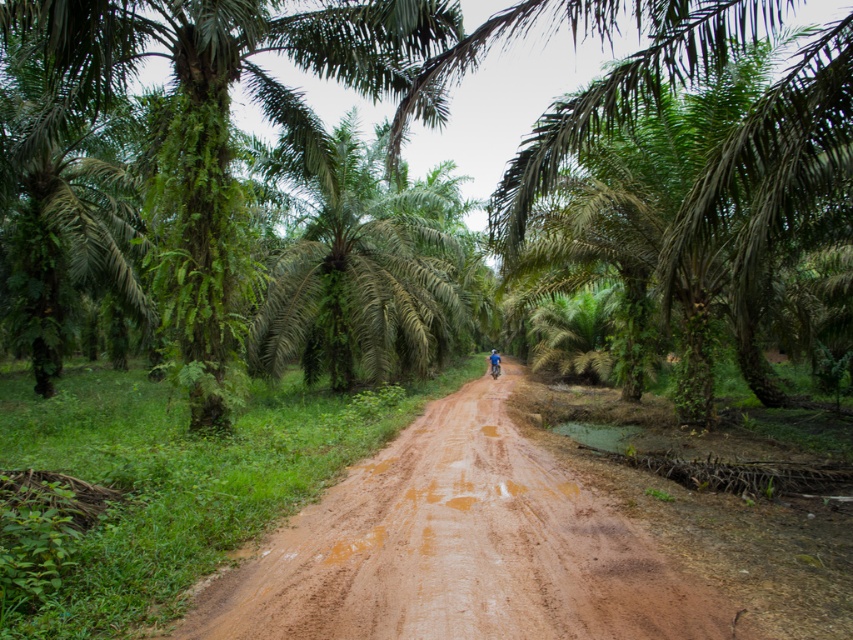
Who is higher up, green leafy palm tree at center or blue fabric helmet at center?

green leafy palm tree at center

Is point (352, 224) farther from camera compared to point (490, 355)?

No, it is in front of (490, 355).

Is point (425, 296) closer to camera compared to point (490, 356)?

Yes, it is in front of point (490, 356).

I want to click on green leafy palm tree at center, so click(x=366, y=269).

Which is above, brown sandy dirt track at center or green leafy palm tree at left?

green leafy palm tree at left

Who is more distant from viewer, (525,492) or (103,26)?

The point (525,492) is more distant.

At what (x,y) coordinates should I click in order to perform the action: click on brown sandy dirt track at center. Please return your answer as a coordinate pair (x, y). The width and height of the screenshot is (853, 640). Looking at the image, I should click on (457, 548).

Can you confirm if green leafy palm tree at left is positioned to the right of blue fabric helmet at center?

Incorrect, green leafy palm tree at left is not on the right side of blue fabric helmet at center.

Does green leafy palm tree at left lie behind blue fabric helmet at center?

No, green leafy palm tree at left is in front of blue fabric helmet at center.

Which is in front, point (102, 0) or point (492, 356)?

Positioned in front is point (102, 0).

The image size is (853, 640). Identify the location of green leafy palm tree at left. (206, 116).